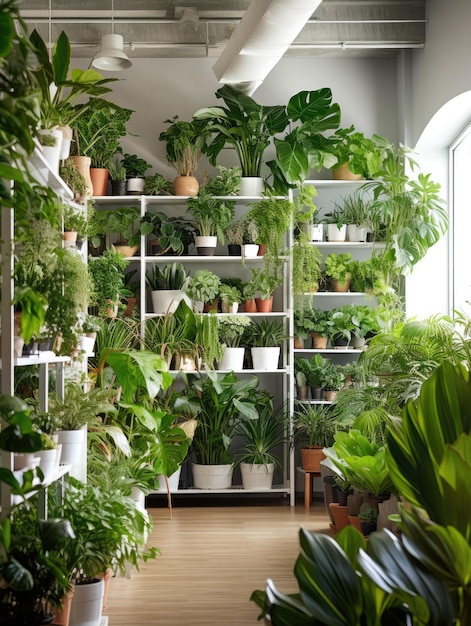
Locate an element on the screen. This screenshot has width=471, height=626. short, wide white plant pot is located at coordinates (211, 475).